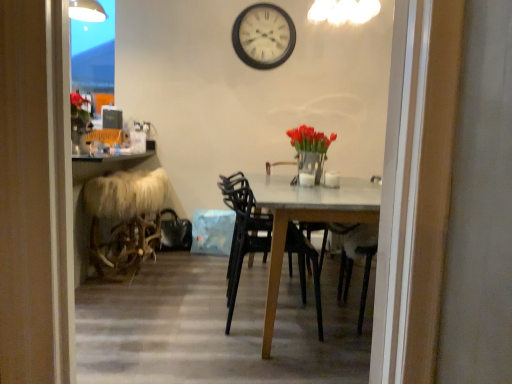
Where is `vacant space in front of black plastic chair at center`? The height and width of the screenshot is (384, 512). vacant space in front of black plastic chair at center is located at coordinates (263, 359).